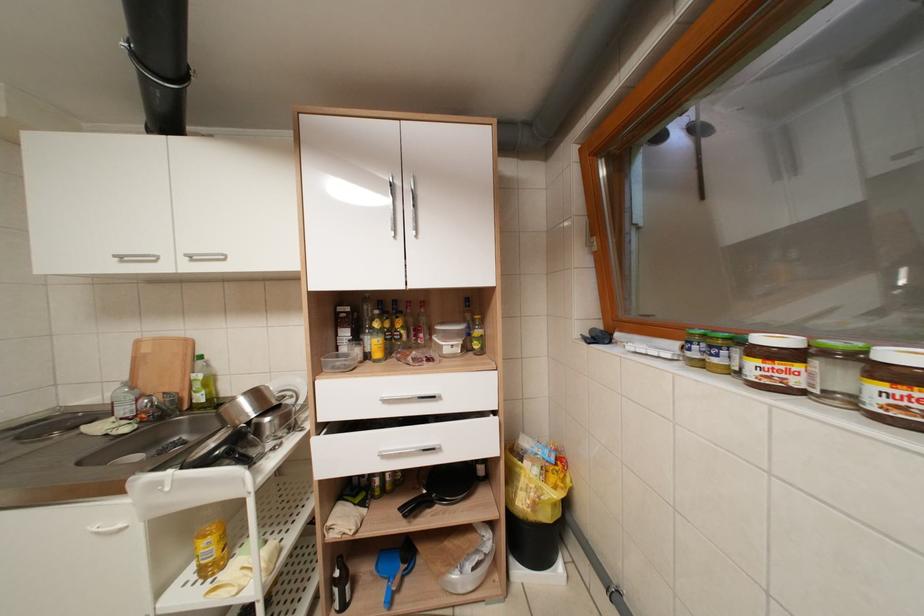
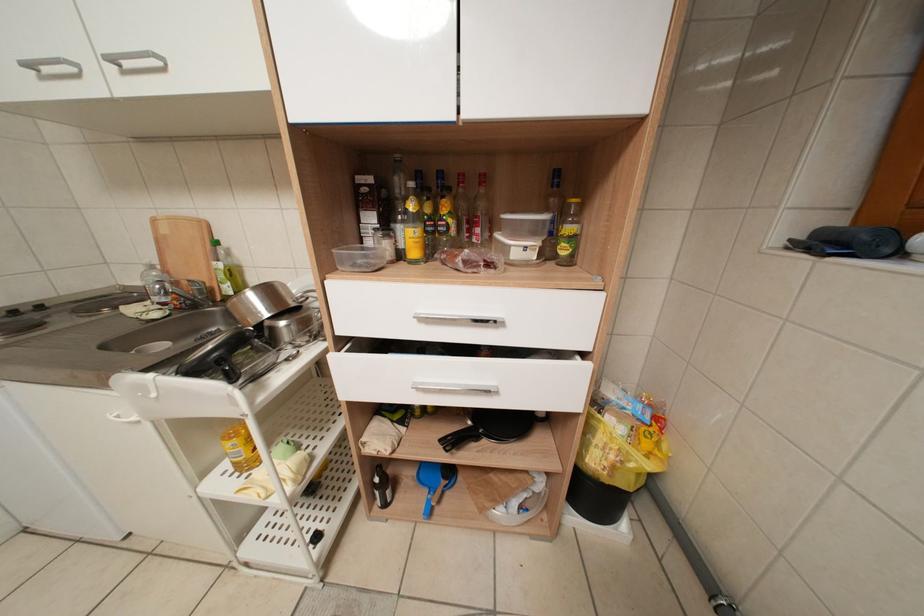
Question: The images are taken continuously from a first-person perspective. In which direction are you moving?

Choices:
 (A) Left
 (B) Right
 (C) Forward
 (D) Backward

Answer: (C)